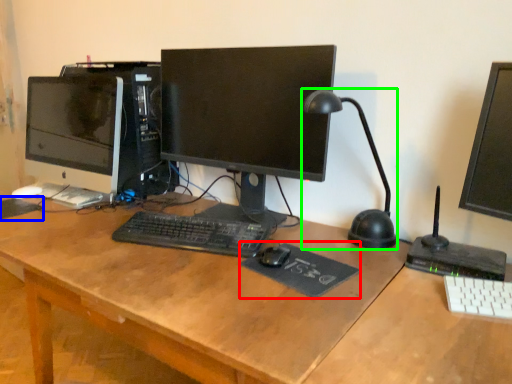
Question: Estimate the real-world distances between objects in this image. Which object is closer to mousepad (highlighted by a red box), mousepad (highlighted by a blue box) or table lamp (highlighted by a green box)?

Choices:
 (A) mousepad
 (B) table lamp

Answer: (B)